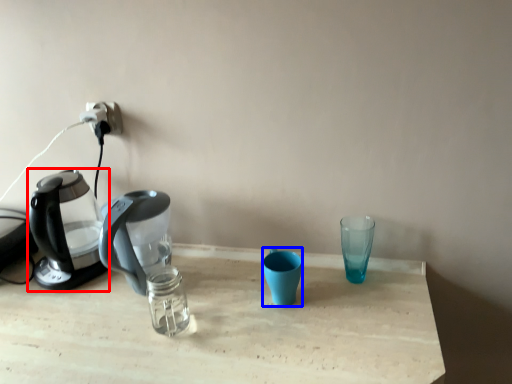
Question: Which of the following is the closest to the observer, kettle (highlighted by a red box) or coffee cup (highlighted by a blue box)?

Choices:
 (A) kettle
 (B) coffee cup

Answer: (B)